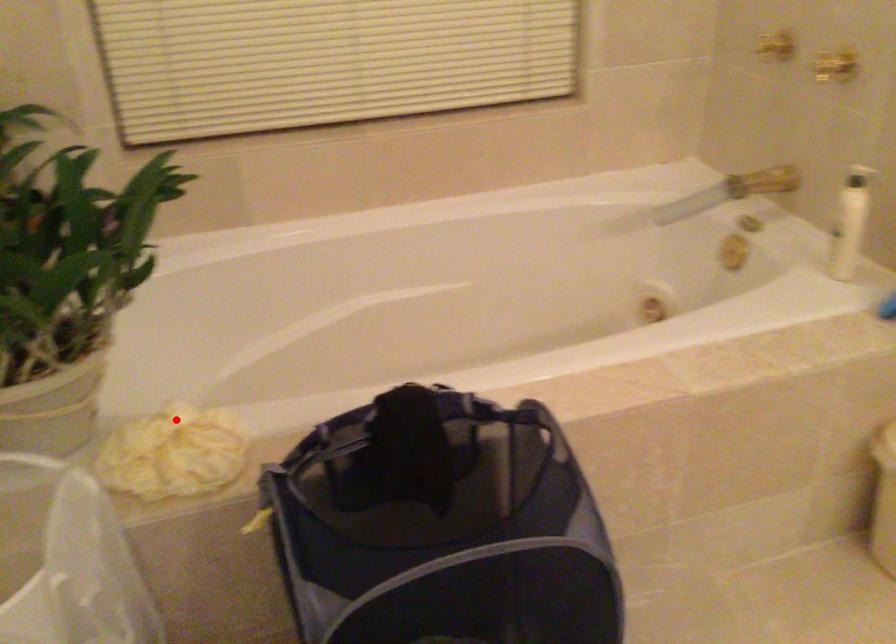
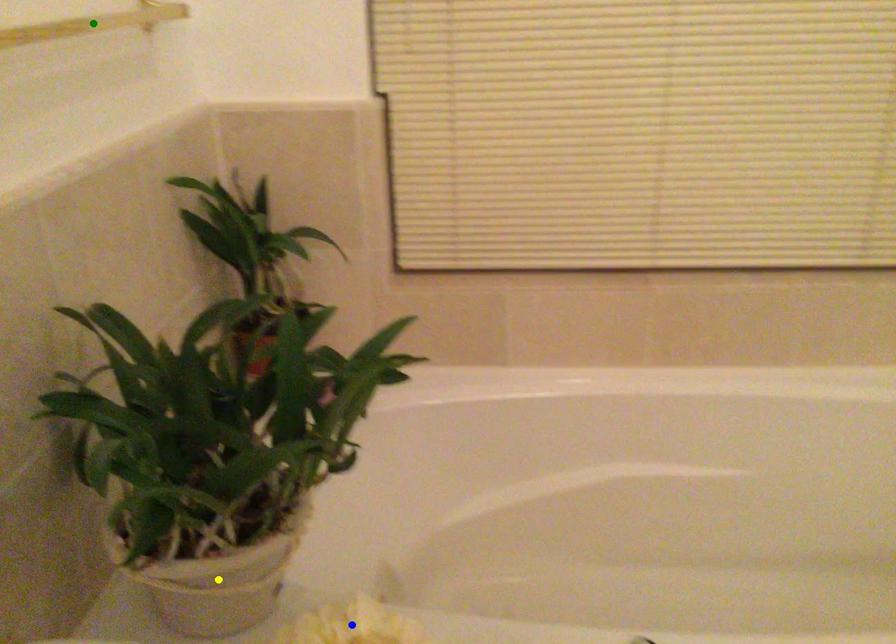
Question: I am providing you with two images of the same scene from different viewpoints. A red point is marked on the first image. You are given multiple points on the second image. Which mark in image 2 goes with the point in image 1?

Choices:
 (A) blue point
 (B) green point
 (C) yellow point

Answer: (A)